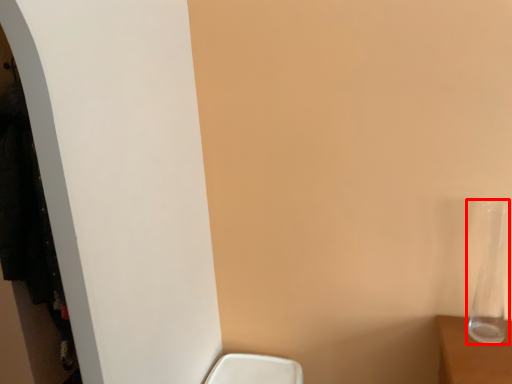
Question: From the image, what is the correct spatial relationship of glass vase (annotated by the red box) in relation to closet?

Choices:
 (A) right
 (B) left

Answer: (A)